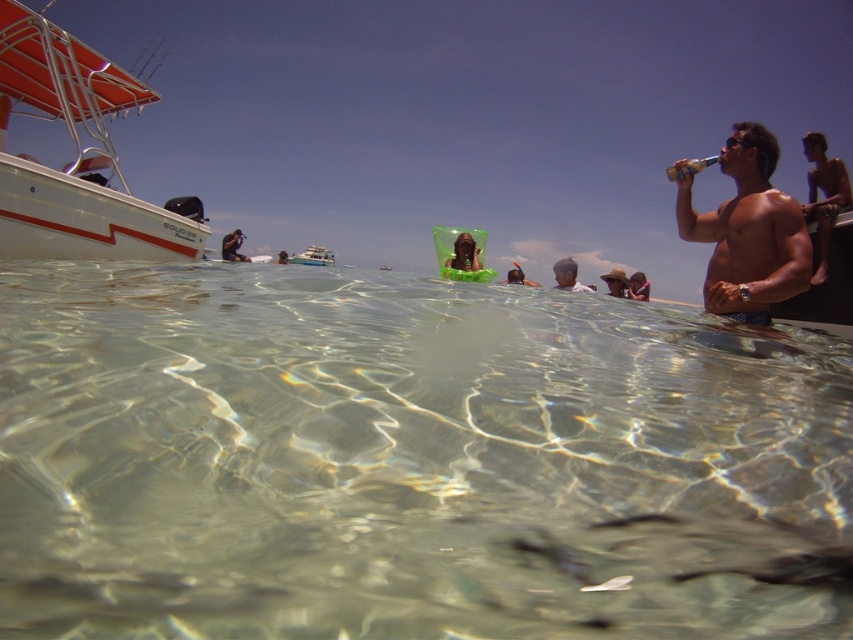
Is white plastic boat at center positioned before smooth skin person at upper right?

No, it is behind smooth skin person at upper right.

Does point (322, 253) lie behind point (647, 300)?

Yes, it is.

The image size is (853, 640). Find the location of `white plastic boat at center`. white plastic boat at center is located at coordinates (312, 257).

Which is in front, point (105, 500) or point (552, 269)?

Point (105, 500) is more forward.

Where is `clear water at center`? This screenshot has width=853, height=640. clear water at center is located at coordinates (403, 460).

Between point (704, 632) and point (90, 250), which one is positioned in front?

Point (704, 632) is more forward.

Between clear water at center and white glossy boat at upper left, which one has more height?

Standing taller between the two is white glossy boat at upper left.

Find the location of a particular element. The height and width of the screenshot is (640, 853). clear water at center is located at coordinates (403, 460).